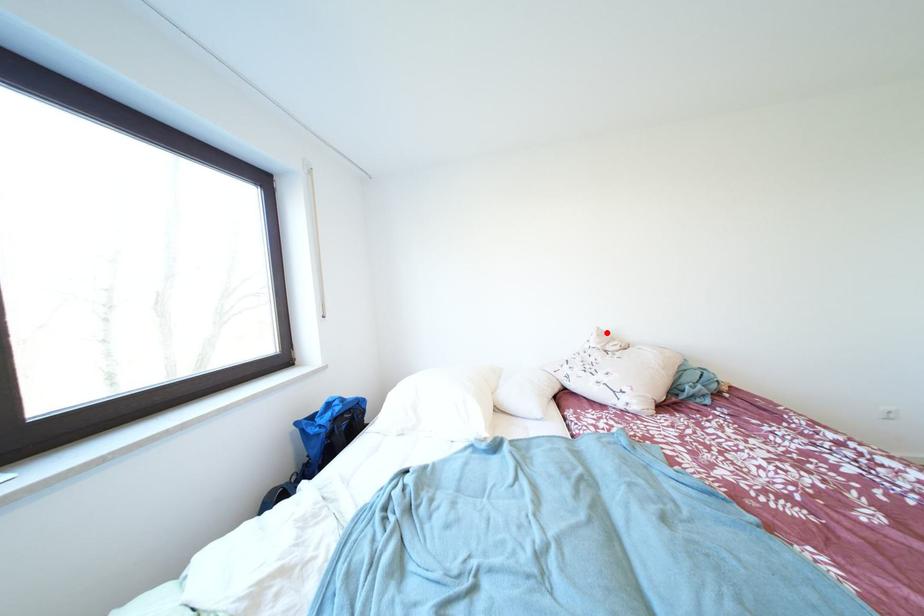
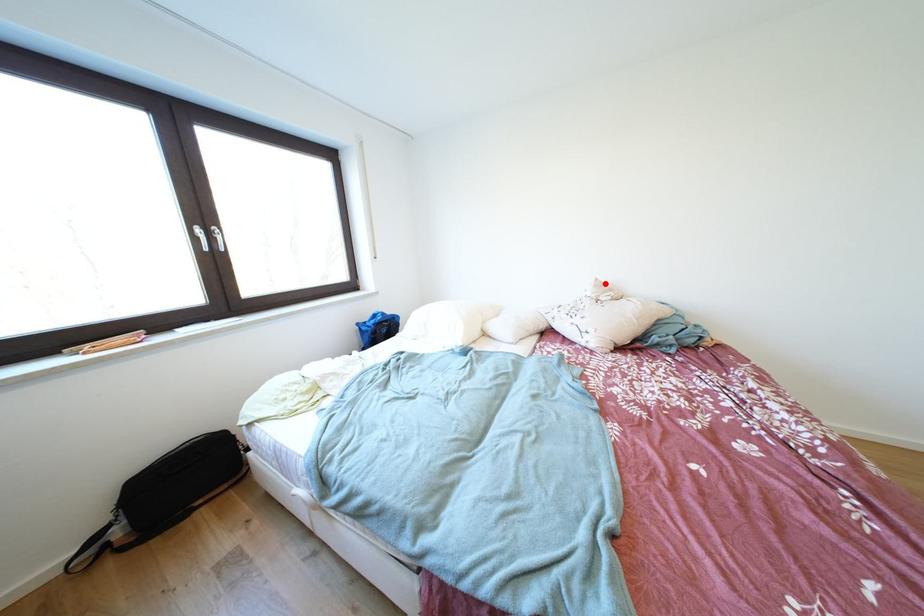
I am providing you with two images of the same scene from different viewpoints. A red point is marked on the first image and another point is marked on the second image. Do the highlighted points in image1 and image2 indicate the same real-world spot?

Yes